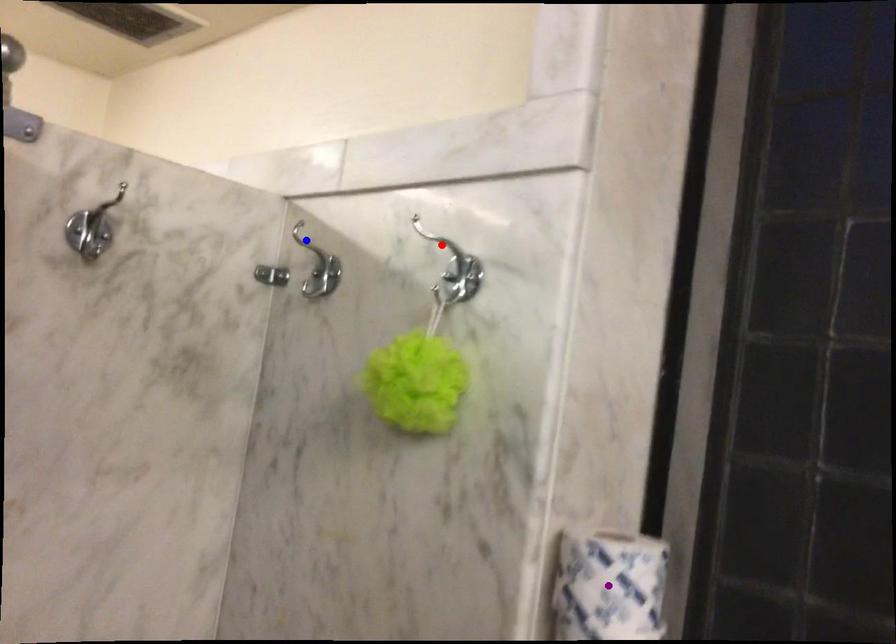
Looking at this image, order these from nearest to farthest:
blue point, purple point, red point

purple point → red point → blue point